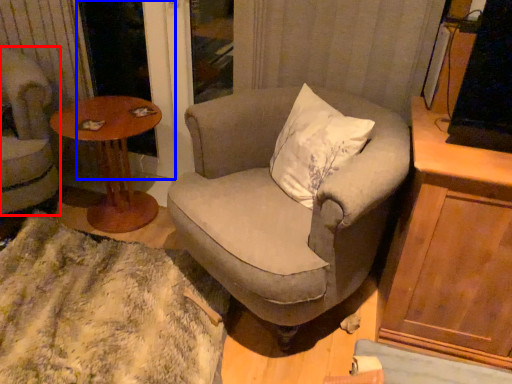
Question: Which point is further to the camera, chair (highlighted by a red box) or screen door (highlighted by a blue box)?

Choices:
 (A) chair
 (B) screen door

Answer: (B)